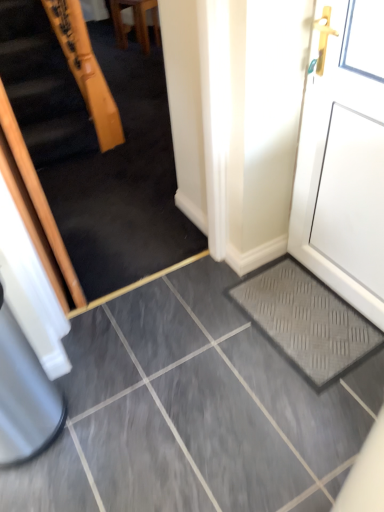
Question: Is wooden handrail at upper left completely or partially outside of wooden chair at upper center?

Choices:
 (A) yes
 (B) no

Answer: (A)

Question: Does wooden handrail at upper left have a larger size compared to wooden chair at upper center?

Choices:
 (A) no
 (B) yes

Answer: (B)

Question: Does wooden handrail at upper left have a smaller size compared to wooden chair at upper center?

Choices:
 (A) no
 (B) yes

Answer: (A)

Question: Is wooden handrail at upper left further to the viewer compared to wooden chair at upper center?

Choices:
 (A) no
 (B) yes

Answer: (A)

Question: From the image's perspective, is wooden handrail at upper left on wooden chair at upper center?

Choices:
 (A) no
 (B) yes

Answer: (A)

Question: Is wooden handrail at upper left facing away from wooden chair at upper center?

Choices:
 (A) no
 (B) yes

Answer: (B)

Question: Does grey rubber doormat at lower right have a greater width compared to wooden chair at upper center?

Choices:
 (A) no
 (B) yes

Answer: (B)

Question: From the image's perspective, does grey rubber doormat at lower right appear lower than wooden chair at upper center?

Choices:
 (A) no
 (B) yes

Answer: (B)

Question: Is grey rubber doormat at lower right outside of wooden chair at upper center?

Choices:
 (A) yes
 (B) no

Answer: (A)

Question: Is grey rubber doormat at lower right to the right of wooden chair at upper center from the viewer's perspective?

Choices:
 (A) yes
 (B) no

Answer: (A)

Question: Does grey rubber doormat at lower right come behind wooden chair at upper center?

Choices:
 (A) no
 (B) yes

Answer: (A)

Question: Does grey rubber doormat at lower right turn towards wooden chair at upper center?

Choices:
 (A) yes
 (B) no

Answer: (B)

Question: Considering the relative sizes of white matte door at right and grey rubber doormat at lower right in the image provided, is white matte door at right smaller than grey rubber doormat at lower right?

Choices:
 (A) no
 (B) yes

Answer: (A)